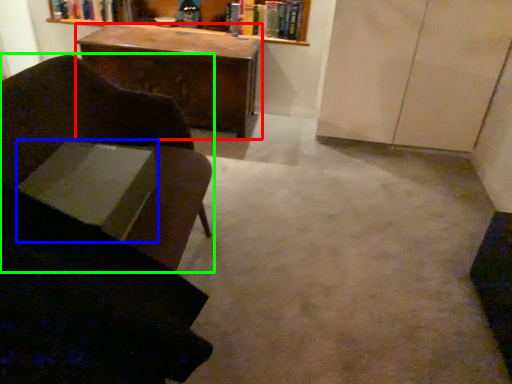
Question: Based on their relative distances, which object is nearer to desk (highlighted by a red box)? Choose from book (highlighted by a blue box) and chair (highlighted by a green box).

Choices:
 (A) book
 (B) chair

Answer: (B)